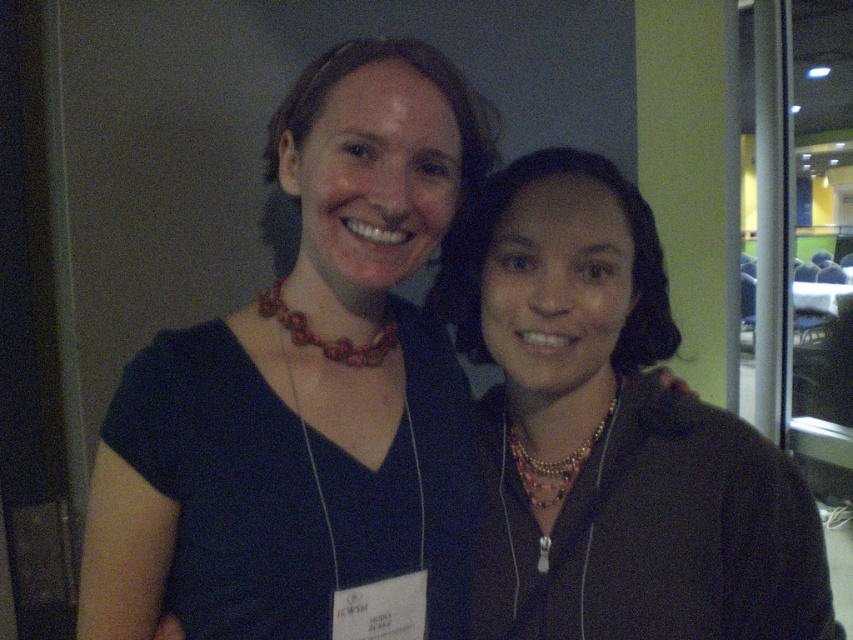
From the picture: Can you confirm if multicolored beaded necklace at center is positioned to the right of pearl-like beads necklace at center?

Yes, multicolored beaded necklace at center is to the right of pearl-like beads necklace at center.

What do you see at coordinates (611, 433) in the screenshot? This screenshot has width=853, height=640. I see `multicolored beaded necklace at center` at bounding box center [611, 433].

Find the location of a particular element. The image size is (853, 640). multicolored beaded necklace at center is located at coordinates (611, 433).

Who is taller, multicolored beaded necklace at center or wooden beads necklace at center?

multicolored beaded necklace at center

Does multicolored beaded necklace at center have a greater width compared to wooden beads necklace at center?

Yes, multicolored beaded necklace at center is wider than wooden beads necklace at center.

At what (x,y) coordinates should I click in order to perform the action: click on multicolored beaded necklace at center. Please return your answer as a coordinate pair (x, y). Looking at the image, I should click on (611, 433).

Can you confirm if wooden beads necklace at center is positioned below pearl-like beads necklace at center?

No, wooden beads necklace at center is not below pearl-like beads necklace at center.

Between wooden beads necklace at center and pearl-like beads necklace at center, which one is positioned higher?

wooden beads necklace at center is higher up.

You are a GUI agent. You are given a task and a screenshot of the screen. Output one action in this format:
    pyautogui.click(x=<x>, y=<y>)
    Task: Click on the wooden beads necklace at center
    This screenshot has height=640, width=853.
    Given the screenshot: What is the action you would take?
    coord(329,340)

What are the coordinates of `wooden beads necklace at center` in the screenshot? It's located at (329, 340).